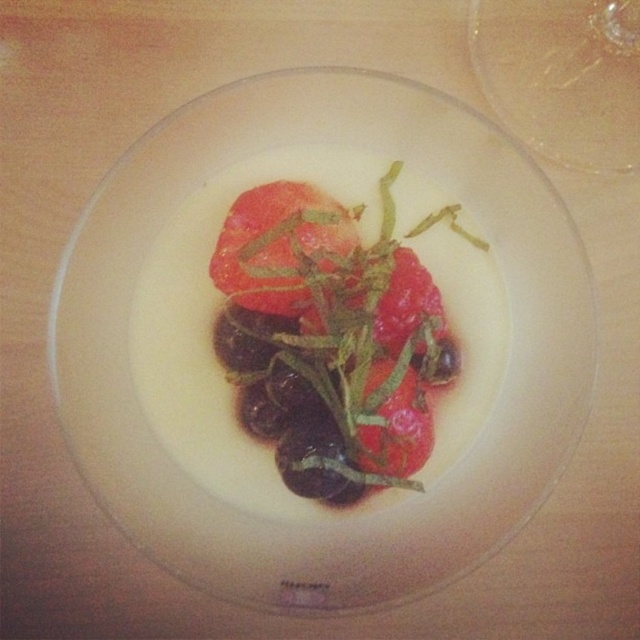
Can you confirm if matte white salad at center is wider than glossy red tomato at center?

Indeed, matte white salad at center has a greater width compared to glossy red tomato at center.

Where is `matte white salad at center`? matte white salad at center is located at coordinates (330, 337).

Locate an element on the screen. matte white salad at center is located at coordinates click(x=330, y=337).

Does point (595, 320) lie in front of point (252, 272)?

Yes, point (595, 320) is in front of point (252, 272).

Looking at this image, between white glossy platter at center and glossy red tomato at center, which one appears on the left side from the viewer's perspective?

glossy red tomato at center

The width and height of the screenshot is (640, 640). Find the location of `white glossy platter at center`. white glossy platter at center is located at coordinates (381, 509).

Identify the location of white glossy platter at center. The image size is (640, 640). (381, 509).

Which is more to the right, white glossy platter at center or matte white salad at center?

From the viewer's perspective, matte white salad at center appears more on the right side.

Which is in front, point (214, 572) or point (262, 189)?

Positioned in front is point (214, 572).

The width and height of the screenshot is (640, 640). I want to click on white glossy platter at center, so click(x=381, y=509).